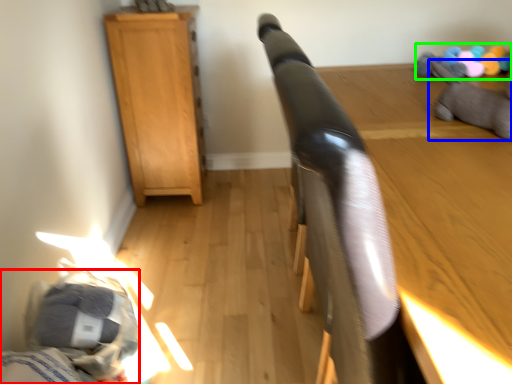
Question: Based on their relative distances, which object is farther from bed (highlighted by a red box)? Choose from animal (highlighted by a blue box) and toy (highlighted by a green box).

Choices:
 (A) animal
 (B) toy

Answer: (B)